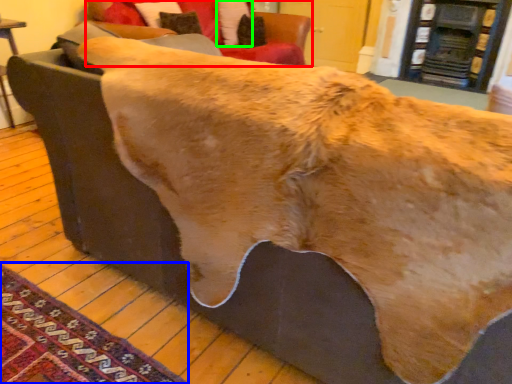
Question: Which object is the farthest from studio couch (highlighted by a red box)? Choose among these: mat (highlighted by a blue box) or pillow (highlighted by a green box).

Choices:
 (A) mat
 (B) pillow

Answer: (A)